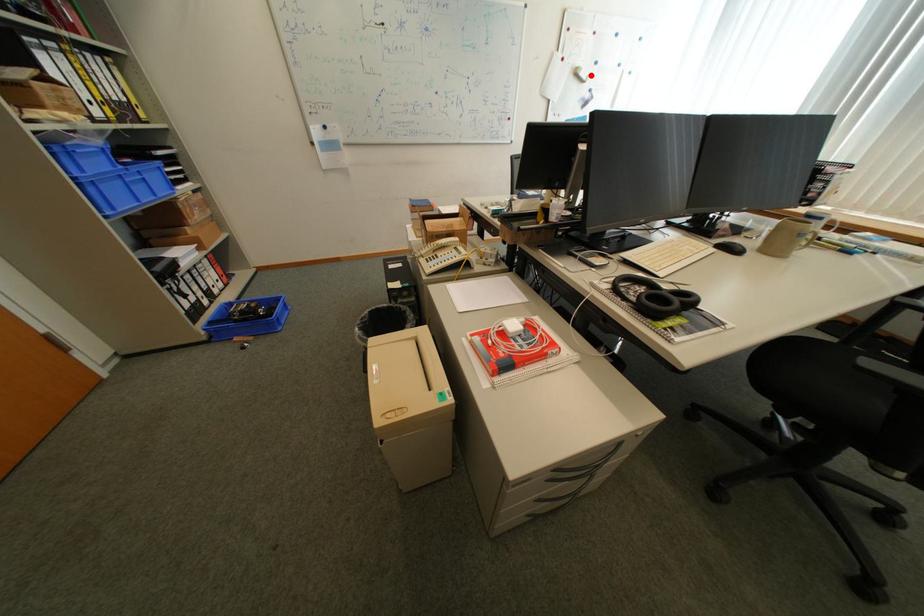
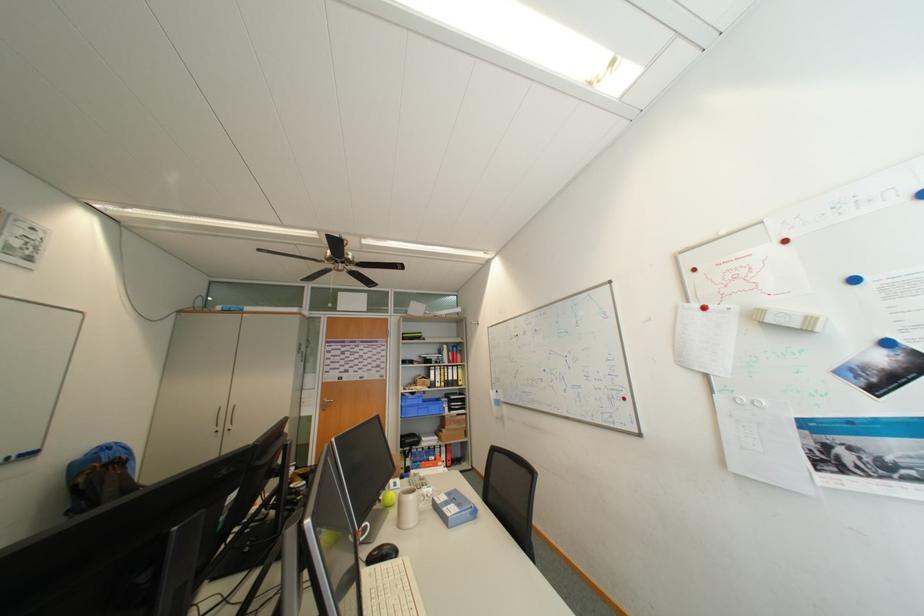
Question: I am providing you with two images of the same scene from different viewpoints. A red point is marked on the first image. Can you still see the location of the red point in image 2?

Choices:
 (A) Yes
 (B) No

Answer: (A)